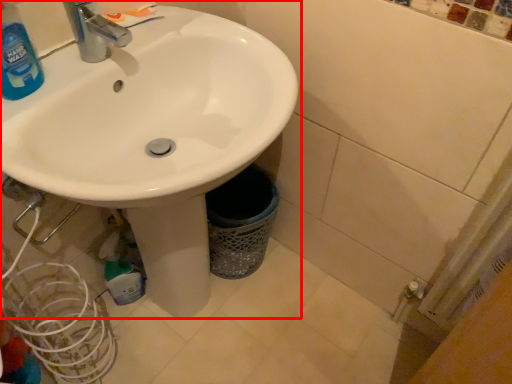
Question: From the image's perspective, what is the correct spatial positioning of sink (annotated by the red box) in reference to cleaning product?

Choices:
 (A) above
 (B) below

Answer: (B)